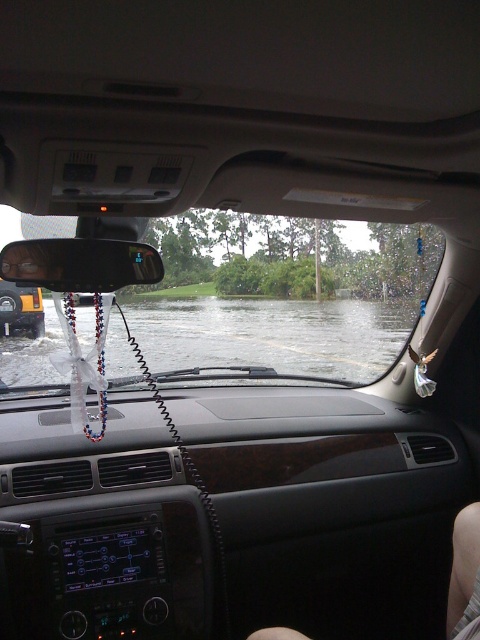
Does clear water at center have a smaller size compared to metallic yellow truck at center?

No.

The height and width of the screenshot is (640, 480). Find the location of `clear water at center`. clear water at center is located at coordinates (273, 333).

Which is more to the right, transparent glass windshield at center or metallic yellow truck at center?

From the viewer's perspective, transparent glass windshield at center appears more on the right side.

Is transparent glass windshield at center smaller than metallic yellow truck at center?

No, transparent glass windshield at center is not smaller than metallic yellow truck at center.

What do you see at coordinates (285, 292) in the screenshot? This screenshot has height=640, width=480. I see `transparent glass windshield at center` at bounding box center [285, 292].

The image size is (480, 640). In order to click on transparent glass windshield at center in this screenshot , I will do `click(285, 292)`.

Is point (190, 324) positioned after point (312, 336)?

That is True.

Is transparent glass windshield at center shorter than clear water at center?

Incorrect, transparent glass windshield at center's height does not fall short of clear water at center's.

Measure the distance between transparent glass windshield at center and camera.

11.24 feet

Identify the location of transparent glass windshield at center. (285, 292).